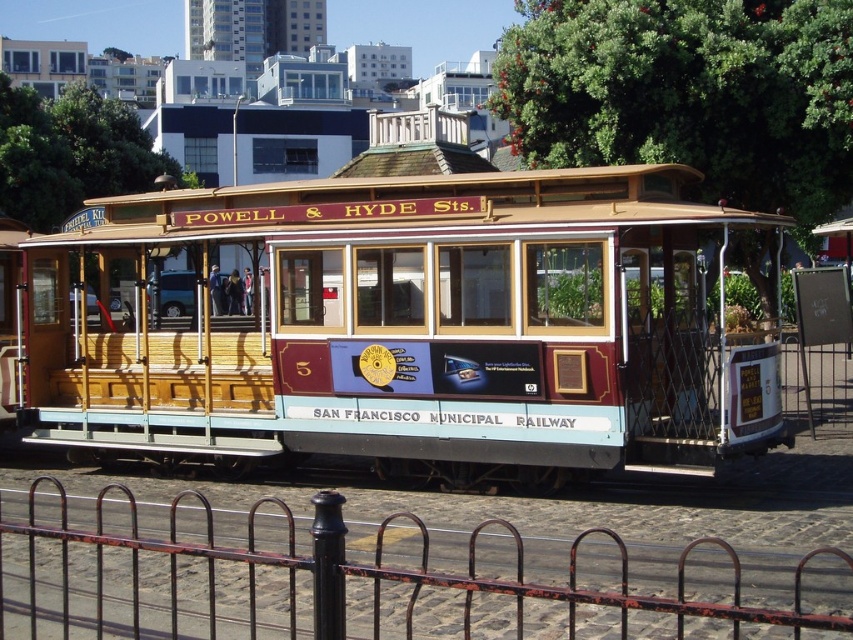
Question: Is wooden cable car at center further to the viewer compared to rusty metal fence at lower center?

Choices:
 (A) yes
 (B) no

Answer: (B)

Question: Which of the following is the closest to the observer?

Choices:
 (A) (743, 584)
 (B) (386, 417)

Answer: (A)

Question: Is wooden cable car at center to the left of rusty metal fence at lower center from the viewer's perspective?

Choices:
 (A) no
 (B) yes

Answer: (A)

Question: Can you confirm if wooden cable car at center is positioned to the left of rusty metal fence at lower center?

Choices:
 (A) yes
 (B) no

Answer: (B)